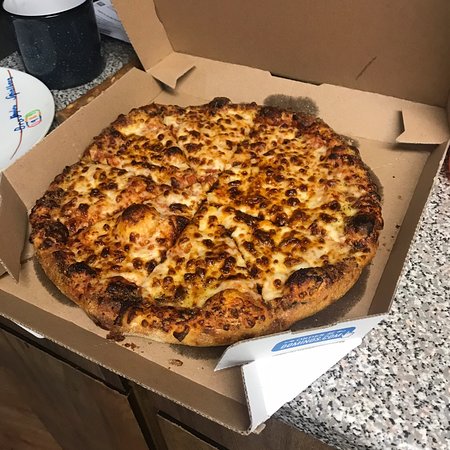
I want to click on counter, so click(x=373, y=393).